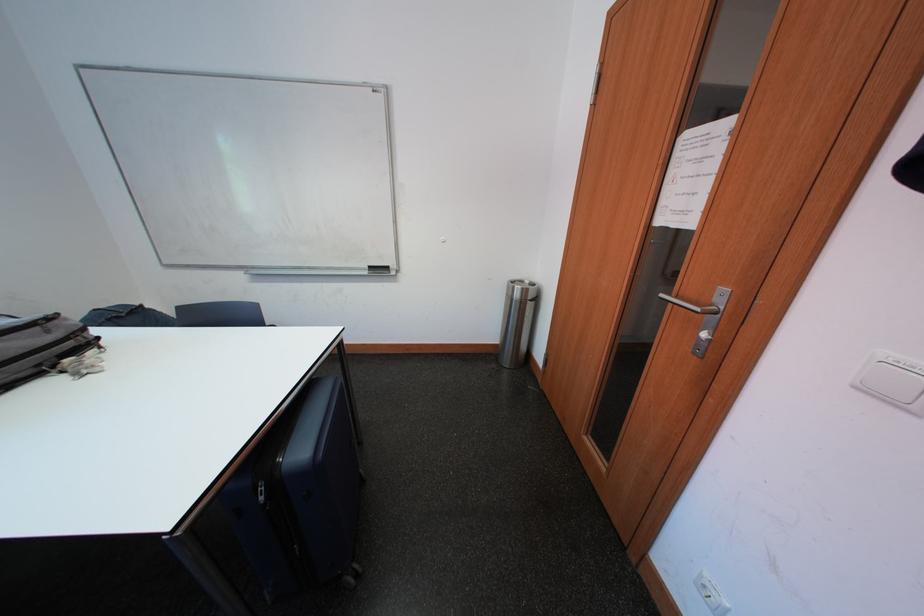
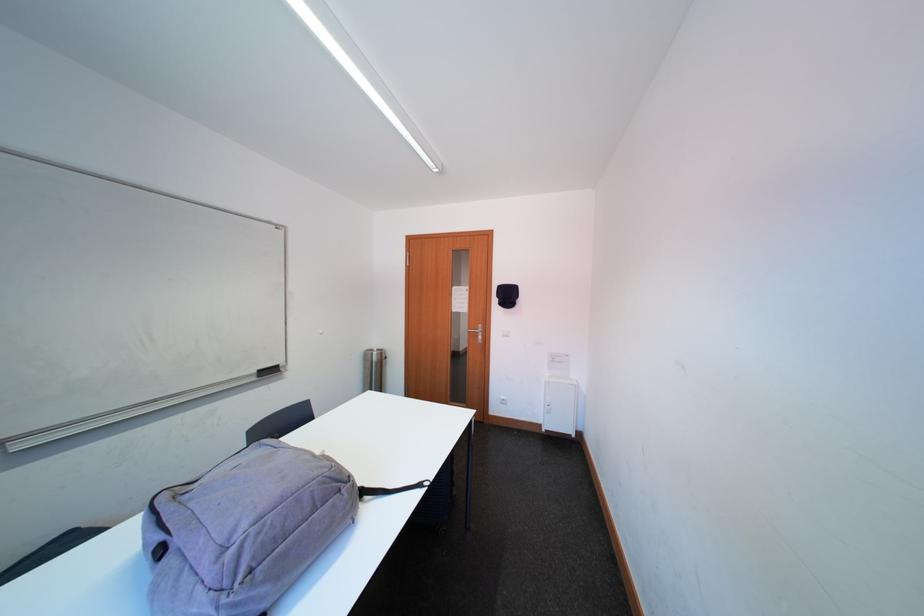
Find the pixel in the second image that matches the point at 523,291 in the first image.

(382, 358)